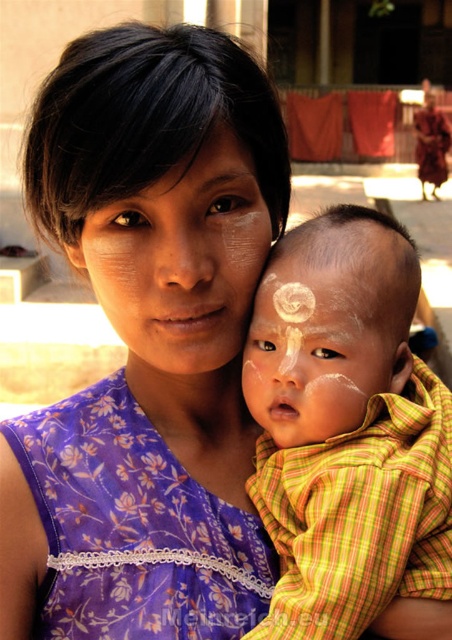
Question: Which of these objects is positioned farthest from the white painted face at center?

Choices:
 (A) purple floral fabric dress at center
 (B) pale skin with white markings at center

Answer: (A)

Question: Among these objects, which one is nearest to the camera?

Choices:
 (A) white painted face at center
 (B) pale skin with white markings at center

Answer: (A)

Question: Can you confirm if purple floral fabric dress at center is smaller than pale skin with white markings at center?

Choices:
 (A) no
 (B) yes

Answer: (A)

Question: Which object appears closest to the camera in this image?

Choices:
 (A) white painted face at center
 (B) purple floral fabric dress at center
 (C) pale skin with white markings at center

Answer: (A)

Question: Is purple floral fabric dress at center above pale skin with white markings at center?

Choices:
 (A) yes
 (B) no

Answer: (B)

Question: Is pale skin with white markings at center positioned in front of white painted face at center?

Choices:
 (A) yes
 (B) no

Answer: (B)